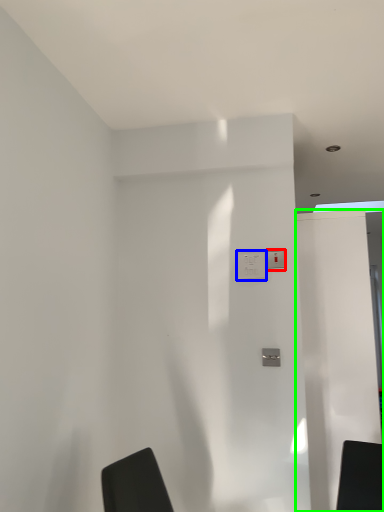
Question: Which is farther away from light switch (highlighted by a red box)? electric outlet (highlighted by a blue box) or screen door (highlighted by a green box)?

Choices:
 (A) electric outlet
 (B) screen door

Answer: (B)